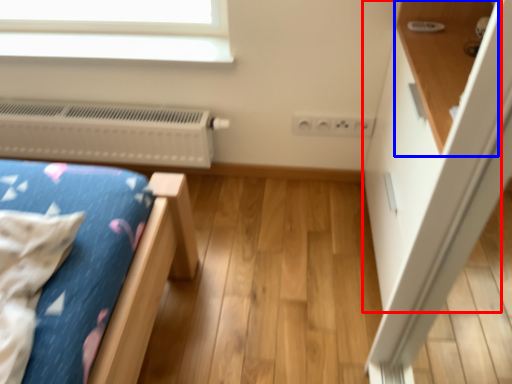
Question: Among these objects, which one is nearest to the camera, dresser (highlighted by a red box) or shelf (highlighted by a blue box)?

Choices:
 (A) dresser
 (B) shelf

Answer: (B)